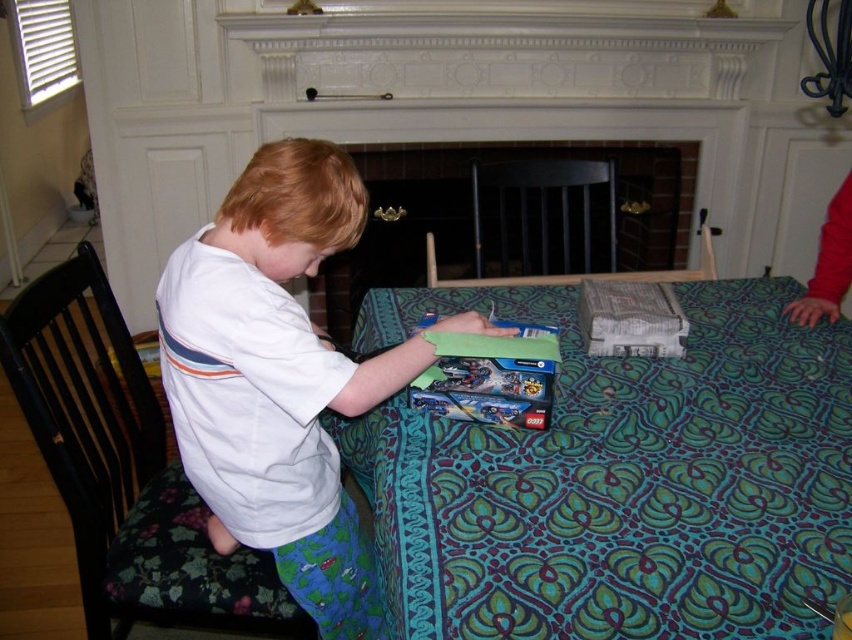
You are a delivery person who needs to place a package on the table between the green patterned fabric at center and the brick fireplace at center. The package is 1.5 meters long. Will it fit between them?

The distance between the green patterned fabric at center and the brick fireplace at center is 1.63 meters, so the 1.5 meters long package will fit between them.

The boy is trying to place his white cotton shirt at center on the green patterned fabric at center. Will the shirt fit entirely on the fabric without any part hanging off?

The green patterned fabric at center is wider than the white cotton shirt at center, so the shirt will fit entirely on the fabric without any part hanging off.